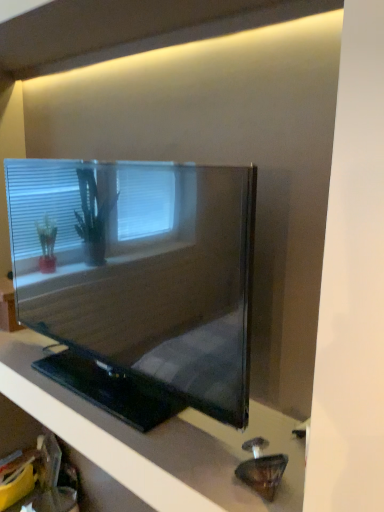
Question: Can you confirm if black glossy tv at center is bigger than matte black tv at center?

Choices:
 (A) yes
 (B) no

Answer: (B)

Question: Does black glossy tv at center have a lesser width compared to matte black tv at center?

Choices:
 (A) no
 (B) yes

Answer: (A)

Question: From a real-world perspective, does black glossy tv at center stand above matte black tv at center?

Choices:
 (A) yes
 (B) no

Answer: (B)

Question: Does black glossy tv at center appear on the right side of matte black tv at center?

Choices:
 (A) yes
 (B) no

Answer: (B)

Question: Can you confirm if black glossy tv at center is positioned to the left of matte black tv at center?

Choices:
 (A) yes
 (B) no

Answer: (A)

Question: Is black glossy tv at center positioned beyond the bounds of matte black tv at center?

Choices:
 (A) yes
 (B) no

Answer: (A)

Question: Does matte black tv at center have a smaller size compared to black glossy tv at center?

Choices:
 (A) yes
 (B) no

Answer: (B)

Question: From the image's perspective, is matte black tv at center on black glossy tv at center?

Choices:
 (A) no
 (B) yes

Answer: (B)

Question: Can you confirm if matte black tv at center is taller than black glossy tv at center?

Choices:
 (A) no
 (B) yes

Answer: (B)

Question: Would you say matte black tv at center is a long distance from black glossy tv at center?

Choices:
 (A) no
 (B) yes

Answer: (A)

Question: Can you confirm if matte black tv at center is shorter than black glossy tv at center?

Choices:
 (A) no
 (B) yes

Answer: (A)

Question: Considering the relative sizes of matte black tv at center and black glossy tv at center in the image provided, is matte black tv at center thinner than black glossy tv at center?

Choices:
 (A) yes
 (B) no

Answer: (A)

Question: From a real-world perspective, relative to black glossy tv at center, is matte black tv at center vertically above or below?

Choices:
 (A) above
 (B) below

Answer: (A)